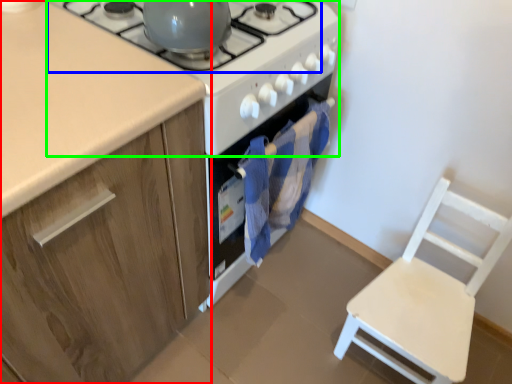
Question: Considering the real-world distances, which object is closest to cabinetry (highlighted by a red box)? gas stove (highlighted by a blue box) or gas stove (highlighted by a green box).

Choices:
 (A) gas stove
 (B) gas stove

Answer: (B)